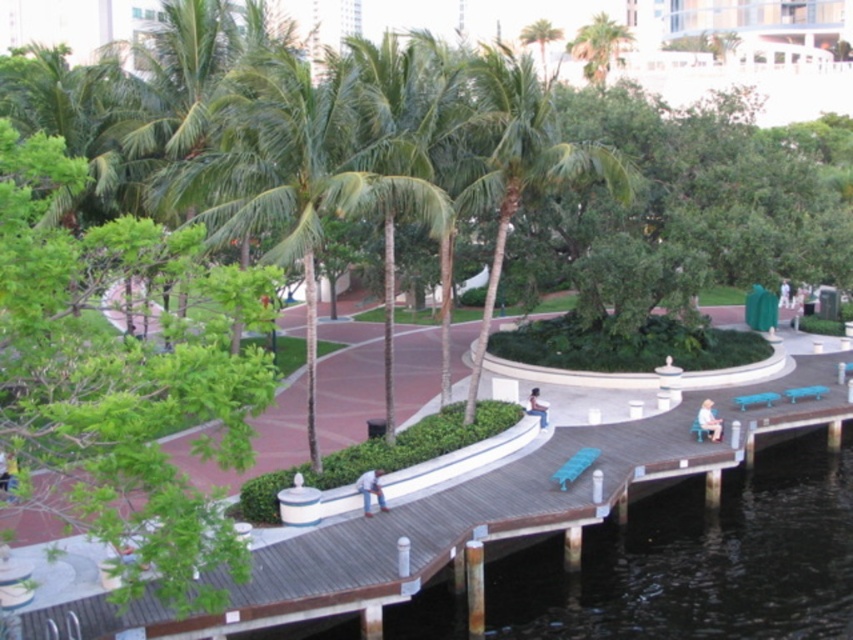
You are a park visitor standing at the entrance of the park. You see the wooden dock at center and the wooden walkway at center. Which structure is closer to you?

The wooden dock at center is positioned under the wooden walkway at center, so the wooden dock at center is closer to you.

Based on the photo, you are planning to set up a picnic area in the park. You have a picnic blanket that can fit under the blue fabric umbrella at upper right. Can the green leafy palm tree at upper center also accommodate the same size picnic blanket underneath it?

The green leafy palm tree at upper center might be wider than blue fabric umbrella at upper right, so it can also accommodate the same size picnic blanket underneath it.